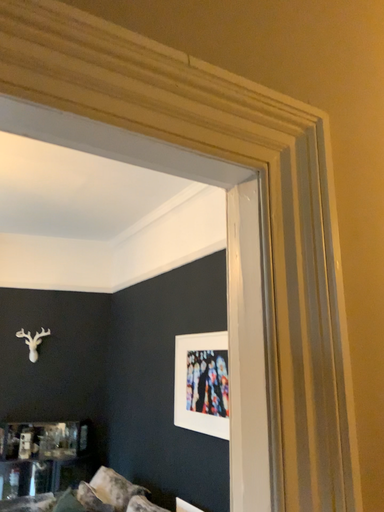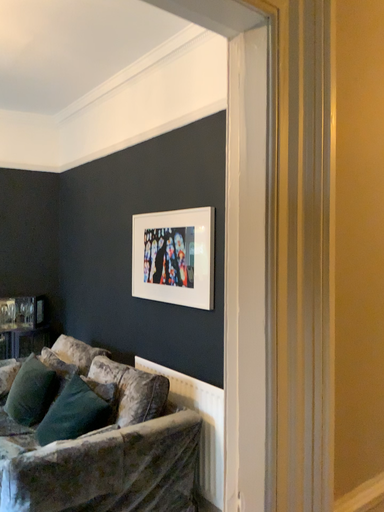
Question: Which way did the camera rotate in the video?

Choices:
 (A) rotated downward
 (B) rotated upward

Answer: (A)